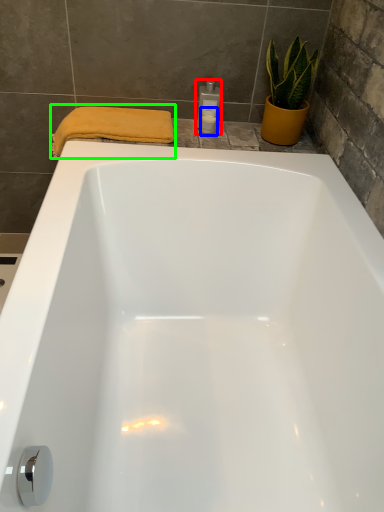
Question: Which is farther away from toiletry (highlighted by a red box)? toiletry (highlighted by a blue box) or bath towel (highlighted by a green box)?

Choices:
 (A) toiletry
 (B) bath towel

Answer: (B)